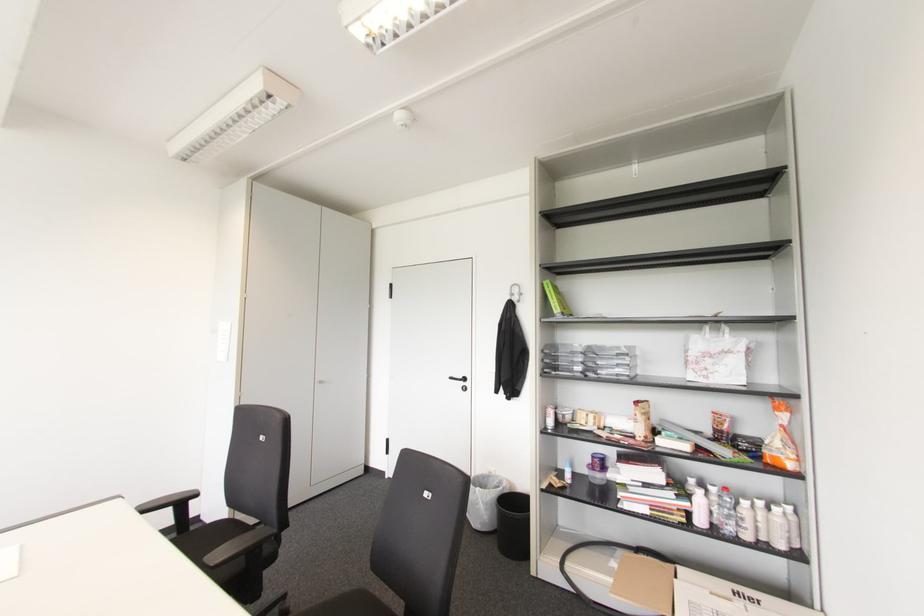
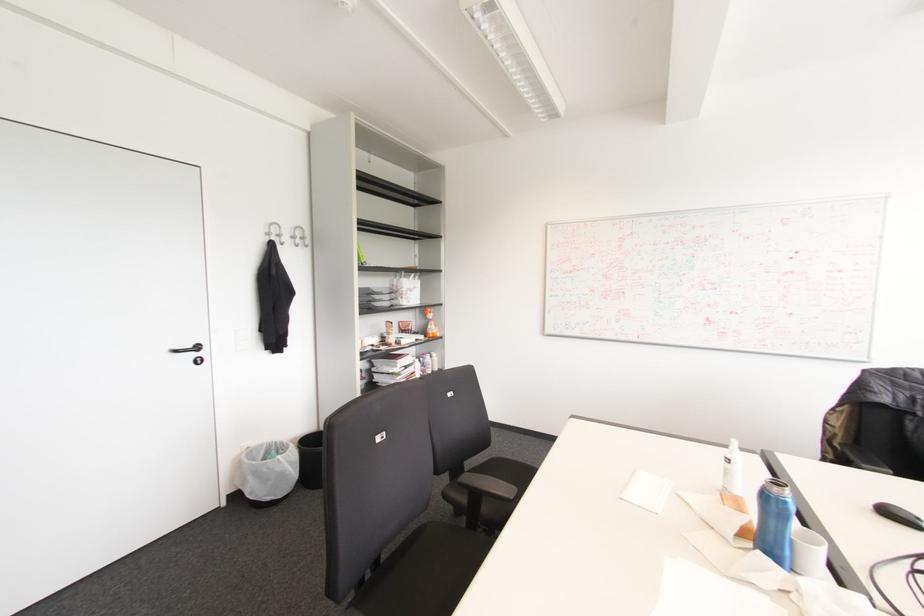
The point at [464,379] is marked in the first image. Where is the corresponding point in the second image?

(197, 347)